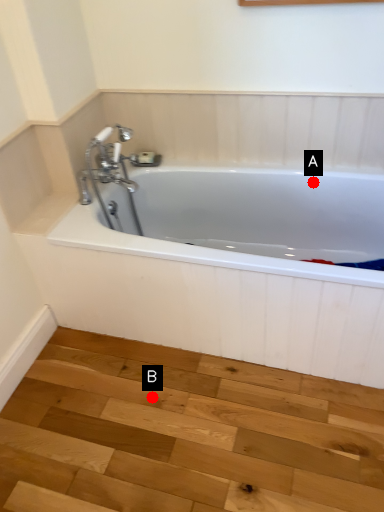
Question: Two points are circled on the image, labeled by A and B beside each circle. Which point is closer to the camera?

Choices:
 (A) A is closer
 (B) B is closer

Answer: (B)